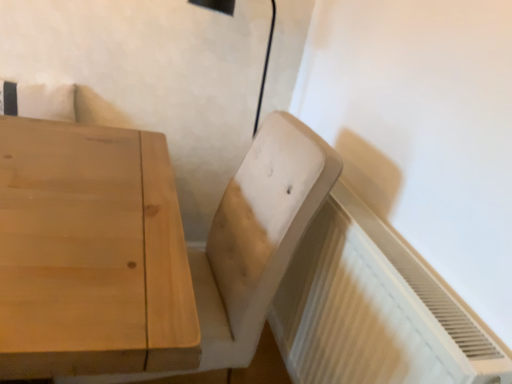
Question: Considering the positions of point pos(202,306) and point pos(418,352), is point pos(202,306) closer or farther from the camera than point pos(418,352)?

Choices:
 (A) farther
 (B) closer

Answer: (A)

Question: From the image's perspective, is light brown wood swivel chair at center located above or below white textured radiator at lower right?

Choices:
 (A) above
 (B) below

Answer: (A)

Question: Relative to white textured radiator at lower right, is light brown wood swivel chair at center in front or behind?

Choices:
 (A) behind
 (B) front

Answer: (A)

Question: Is white textured radiator at lower right bigger or smaller than light brown wood swivel chair at center?

Choices:
 (A) small
 (B) big

Answer: (A)

Question: Would you say white textured radiator at lower right is to the left or to the right of light brown wood swivel chair at center in the picture?

Choices:
 (A) left
 (B) right

Answer: (B)

Question: Considering the positions of point (298, 289) and point (252, 326), is point (298, 289) closer or farther from the camera than point (252, 326)?

Choices:
 (A) closer
 (B) farther

Answer: (B)

Question: From a real-world perspective, relative to light brown wood swivel chair at center, is white textured radiator at lower right vertically above or below?

Choices:
 (A) below
 (B) above

Answer: (A)